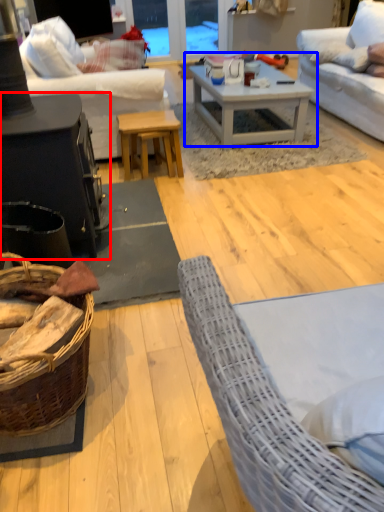
Question: Which object is further to the camera taking this photo, table (highlighted by a red box) or coffee table (highlighted by a blue box)?

Choices:
 (A) table
 (B) coffee table

Answer: (B)